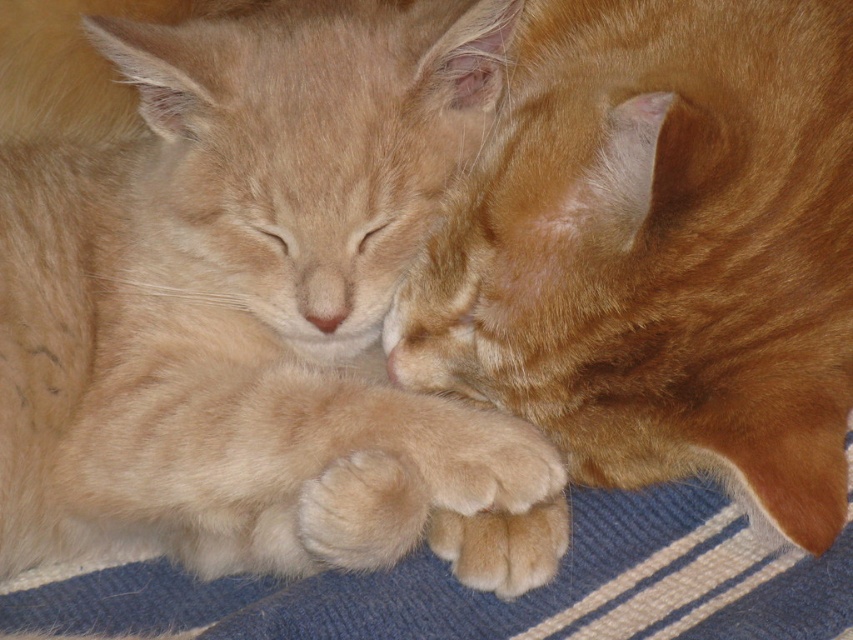
Is fuzzy orange paw at lower center closer to camera compared to soft fur paw at lower center?

That is True.

Between point (529, 472) and point (480, 573), which one is positioned behind?

Positioned behind is point (480, 573).

Find the location of a particular element. fuzzy orange paw at lower center is located at coordinates (486, 460).

Locate an element on the screen. This screenshot has height=640, width=853. soft orange fur at center is located at coordinates (241, 285).

Is soft orange fur at center closer to camera compared to fuzzy orange paw at lower center?

No.

You are a GUI agent. You are given a task and a screenshot of the screen. Output one action in this format:
    pyautogui.click(x=<x>, y=<y>)
    Task: Click on the soft orange fur at center
    
    Given the screenshot: What is the action you would take?
    pyautogui.click(x=241, y=285)

Does orange fur cat at center appear over soft fur paw at lower center?

Indeed, orange fur cat at center is positioned over soft fur paw at lower center.

Does orange fur cat at center appear on the right side of soft fur paw at lower center?

Yes, orange fur cat at center is to the right of soft fur paw at lower center.

Locate an element on the screen. The width and height of the screenshot is (853, 640). orange fur cat at center is located at coordinates (660, 250).